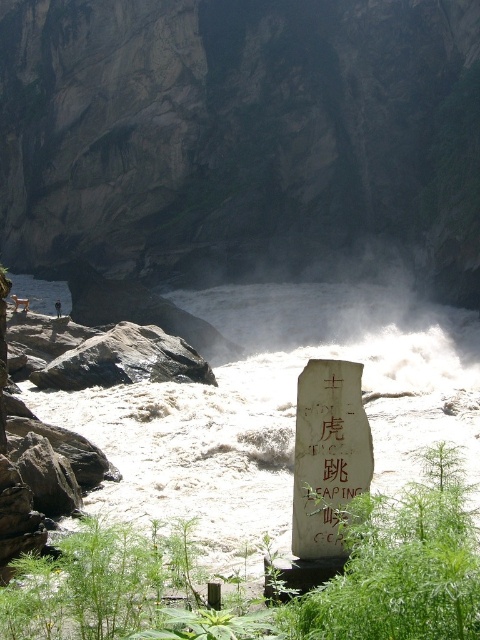
Is white frothy water at center wider than white stone sign at center?

Correct, the width of white frothy water at center exceeds that of white stone sign at center.

Who is more distant from viewer, (x=286, y=330) or (x=344, y=477)?

The point (x=286, y=330) is behind.

Who is more distant from viewer, (x=252, y=284) or (x=324, y=477)?

Point (x=252, y=284)

I want to click on white frothy water at center, so click(x=347, y=330).

Who is more distant from viewer, (300, 536) or (58, 314)?

The point (58, 314) is more distant.

Does white stone sign at center have a lesser width compared to dark brown leather jacket at upper center?

Yes.

Identify the location of white stone sign at center. (327, 454).

The width and height of the screenshot is (480, 640). Find the location of `white stone sign at center`. white stone sign at center is located at coordinates (327, 454).

Does gray rock at left have a lesser height compared to dark brown leather jacket at upper center?

In fact, gray rock at left may be taller than dark brown leather jacket at upper center.

Who is higher up, gray rock at left or dark brown leather jacket at upper center?

Positioned higher is dark brown leather jacket at upper center.

Locate an element on the screen. gray rock at left is located at coordinates (124, 360).